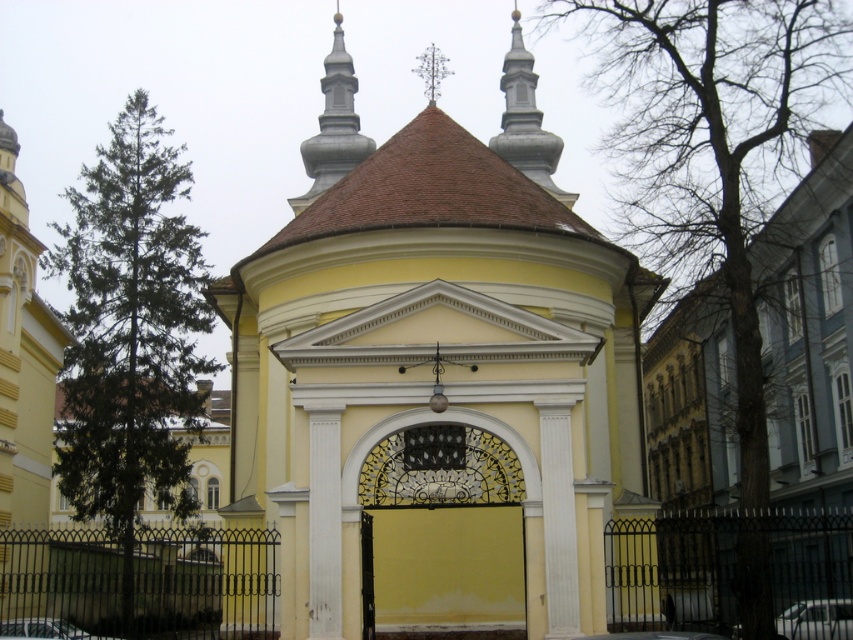
Question: Can you confirm if wrought iron gate at center is positioned above metallic silver car at lower left?

Choices:
 (A) no
 (B) yes

Answer: (B)

Question: Which point is closer to the camera?

Choices:
 (A) (434, 556)
 (B) (788, 252)

Answer: (A)

Question: Which of these objects is positioned closest to the wrought iron gate at center?

Choices:
 (A) yellow matte chapel at center
 (B) yellow matte building at center

Answer: (A)

Question: Estimate the real-world distances between objects in this image. Which object is farther from the yellow matte chapel at center?

Choices:
 (A) metallic silver car at lower right
 (B) metallic silver car at lower left
 (C) yellow matte wall at center

Answer: (A)

Question: Is yellow matte wall at center thinner than metallic silver car at lower left?

Choices:
 (A) yes
 (B) no

Answer: (B)

Question: Can you confirm if wrought iron gate at center is positioned below metallic silver car at lower left?

Choices:
 (A) no
 (B) yes

Answer: (A)